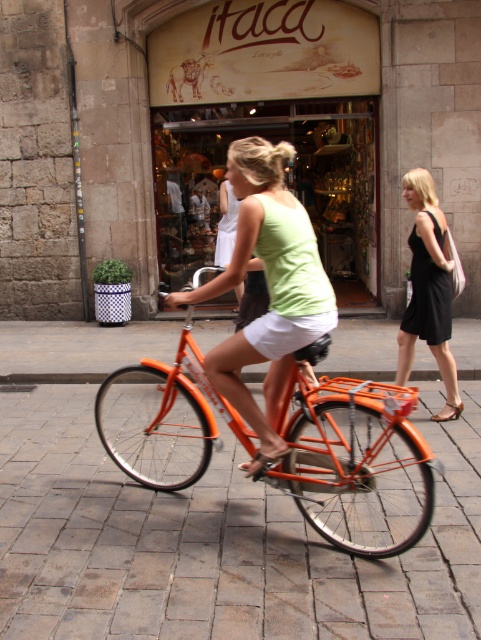
You are a delivery person who needs to enter the shop named Itaca. The entrance is at the center. You see an orange metallic bicycle at center and a matte glass storefront at center. Which object is blocking your path to the entrance?

The orange metallic bicycle at center is blocking your path to the entrance because it is much taller than the matte glass storefront at center, making it an obstacle in your way.

From the picture: You are a fashion designer observing a street scene. You notice two outfits in the image. The first is a matte green tank top at center, and the second is a black dress at right. Which outfit is positioned further to the left?

The matte green tank top at center is positioned to the left of the black dress at right, so it is further to the left.